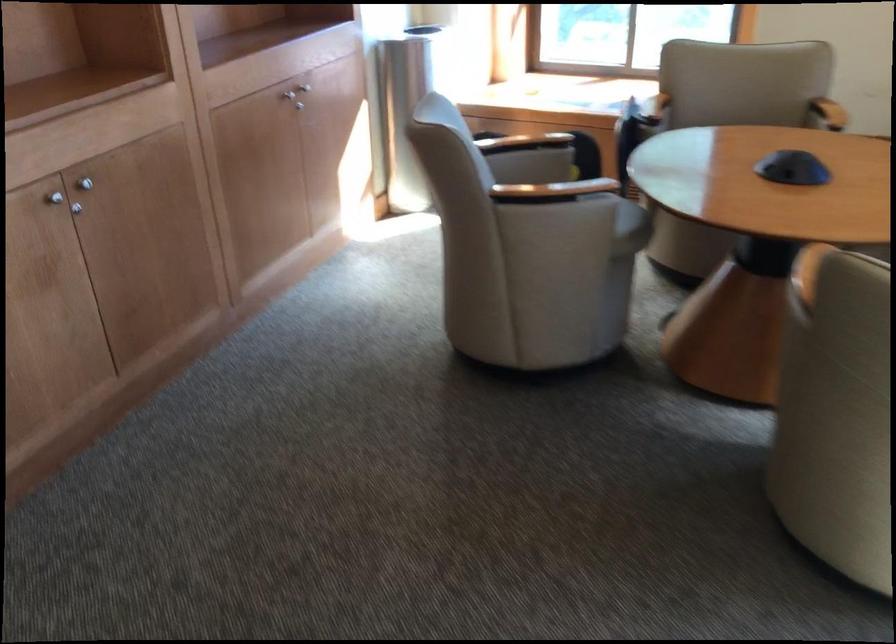
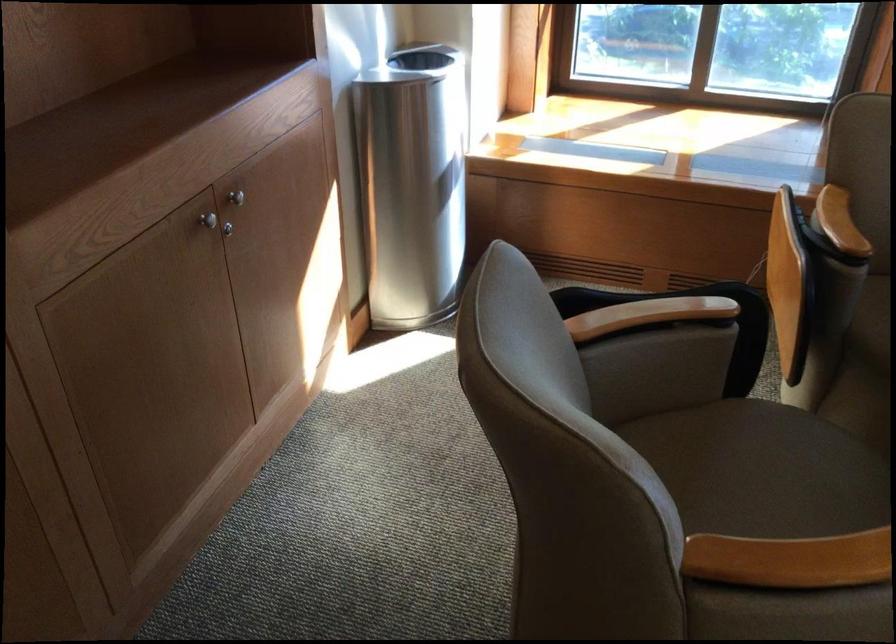
In the second image, find the point that corresponds to the point at 540,187 in the first image.

(789, 560)